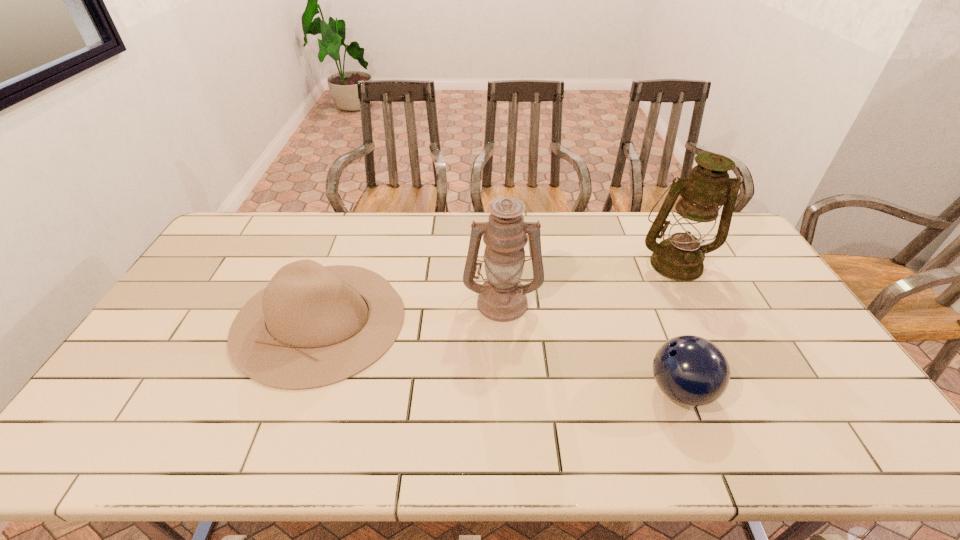
At what (x,y) coordinates should I click in order to perform the action: click on free spot between the right oil lamp and the bowling ball. Please return your answer as a coordinate pair (x, y). Looking at the image, I should click on (678, 327).

Locate an element on the screen. The image size is (960, 540). unoccupied position between the sombrero and the bowling ball is located at coordinates (500, 355).

What are the coordinates of `free space between the nearer oil lamp and the sombrero` in the screenshot? It's located at 411,310.

Identify the location of unoccupied position between the leftmost object and the bowling ball. This screenshot has width=960, height=540. (500, 355).

Choose which object is the third nearest neighbor to the sombrero. Please provide its 2D coordinates. Your answer should be formatted as a tuple, i.e. [(x, y)], where the tuple contains the x and y coordinates of a point satisfying the conditions above.

[(680, 257)]

Image resolution: width=960 pixels, height=540 pixels. In order to click on the closest object to the bowling ball in this screenshot , I will do `click(502, 298)`.